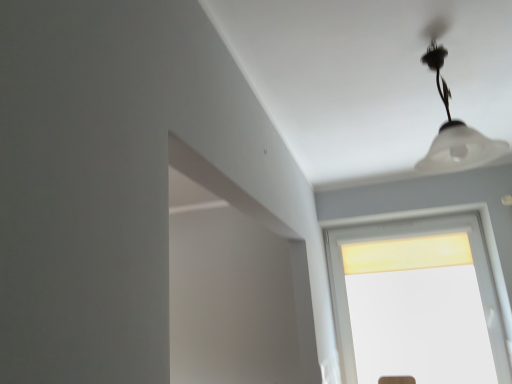
What do you see at coordinates (455, 131) in the screenshot? I see `white frosted lampshade at upper center` at bounding box center [455, 131].

Find the location of a particular element. The width and height of the screenshot is (512, 384). white frosted lampshade at upper center is located at coordinates (455, 131).

Describe the element at coordinates (385, 239) in the screenshot. I see `matte yellow glass window at center` at that location.

In order to click on matte yellow glass window at center in this screenshot , I will do `click(385, 239)`.

Where is `white frosted lampshade at upper center`? The width and height of the screenshot is (512, 384). white frosted lampshade at upper center is located at coordinates (455, 131).

Which is more to the left, matte yellow glass window at center or white frosted lampshade at upper center?

Positioned to the left is white frosted lampshade at upper center.

Relative to white frosted lampshade at upper center, is matte yellow glass window at center in front or behind?

Visually, matte yellow glass window at center is located behind white frosted lampshade at upper center.

Is point (330, 265) positioned before point (455, 159)?

No.

From the image's perspective, which one is positioned lower, matte yellow glass window at center or white frosted lampshade at upper center?

matte yellow glass window at center.

From a real-world perspective, who is located higher, matte yellow glass window at center or white frosted lampshade at upper center?

white frosted lampshade at upper center.

Considering the relative sizes of matte yellow glass window at center and white frosted lampshade at upper center in the image provided, is matte yellow glass window at center thinner than white frosted lampshade at upper center?

Correct, the width of matte yellow glass window at center is less than that of white frosted lampshade at upper center.

Between matte yellow glass window at center and white frosted lampshade at upper center, which one has more height?

With more height is matte yellow glass window at center.

Considering the relative sizes of matte yellow glass window at center and white frosted lampshade at upper center in the image provided, is matte yellow glass window at center bigger than white frosted lampshade at upper center?

Yes, matte yellow glass window at center is bigger than white frosted lampshade at upper center.

Is matte yellow glass window at center situated inside white frosted lampshade at upper center or outside?

matte yellow glass window at center is located beyond the bounds of white frosted lampshade at upper center.

Is matte yellow glass window at center positioned far away from white frosted lampshade at upper center?

Yes, matte yellow glass window at center and white frosted lampshade at upper center are located far from each other.

Is matte yellow glass window at center oriented away from white frosted lampshade at upper center?

matte yellow glass window at center is not turned away from white frosted lampshade at upper center.

Measure the distance from matte yellow glass window at center to white frosted lampshade at upper center.

1.74 meters.

Where is `window on the right of white frosted lampshade at upper center`? The image size is (512, 384). window on the right of white frosted lampshade at upper center is located at coordinates (385, 239).

Looking at this image, between white frosted lampshade at upper center and matte yellow glass window at center, which one appears on the right side from the viewer's perspective?

matte yellow glass window at center is more to the right.

Considering the positions of objects white frosted lampshade at upper center and matte yellow glass window at center in the image provided, who is behind, white frosted lampshade at upper center or matte yellow glass window at center?

Positioned behind is matte yellow glass window at center.

Does point (471, 167) come behind point (502, 295)?

No, it is in front of (502, 295).

From the image's perspective, is white frosted lampshade at upper center located above matte yellow glass window at center?

Yes.

From a real-world perspective, who is located lower, white frosted lampshade at upper center or matte yellow glass window at center?

matte yellow glass window at center is physically lower.

Considering the relative sizes of white frosted lampshade at upper center and matte yellow glass window at center in the image provided, is white frosted lampshade at upper center wider than matte yellow glass window at center?

Correct, the width of white frosted lampshade at upper center exceeds that of matte yellow glass window at center.

Is white frosted lampshade at upper center shorter than matte yellow glass window at center?

Yes, white frosted lampshade at upper center is shorter than matte yellow glass window at center.

Between white frosted lampshade at upper center and matte yellow glass window at center, which one has larger size?

With larger size is matte yellow glass window at center.

Is white frosted lampshade at upper center positioned beyond the bounds of matte yellow glass window at center?

Yes, white frosted lampshade at upper center is located beyond the bounds of matte yellow glass window at center.

Is white frosted lampshade at upper center far away from matte yellow glass window at center?

Yes.

Is white frosted lampshade at upper center looking in the opposite direction of matte yellow glass window at center?

Yes, matte yellow glass window at center is at the back of white frosted lampshade at upper center.

Can you tell me how much white frosted lampshade at upper center and matte yellow glass window at center differ in facing direction?

The angle between the facing direction of white frosted lampshade at upper center and the facing direction of matte yellow glass window at center is 0.00158 degrees.

Measure the distance between white frosted lampshade at upper center and matte yellow glass window at center.

white frosted lampshade at upper center is 5.70 feet from matte yellow glass window at center.

Locate an element on the screen. window that appears below the white frosted lampshade at upper center (from a real-world perspective) is located at coordinates (385, 239).

You are a GUI agent. You are given a task and a screenshot of the screen. Output one action in this format:
    pyautogui.click(x=<x>, y=<y>)
    Task: Click on the window that is below the white frosted lampshade at upper center (from the image's perspective)
    Image resolution: width=512 pixels, height=384 pixels.
    Given the screenshot: What is the action you would take?
    pyautogui.click(x=385, y=239)

Locate an element on the screen. The height and width of the screenshot is (384, 512). window below the white frosted lampshade at upper center (from a real-world perspective) is located at coordinates (385, 239).